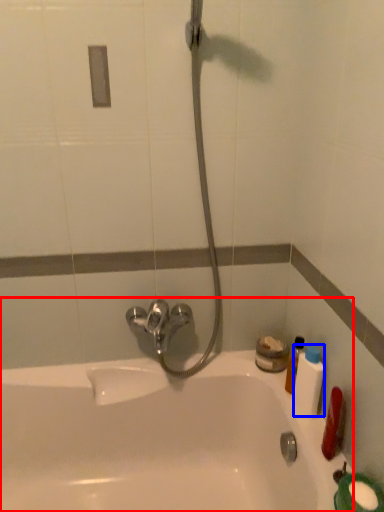
Question: Which of the following is the closest to the observer, bathtub (highlighted by a red box) or mouthwash (highlighted by a blue box)?

Choices:
 (A) bathtub
 (B) mouthwash

Answer: (A)